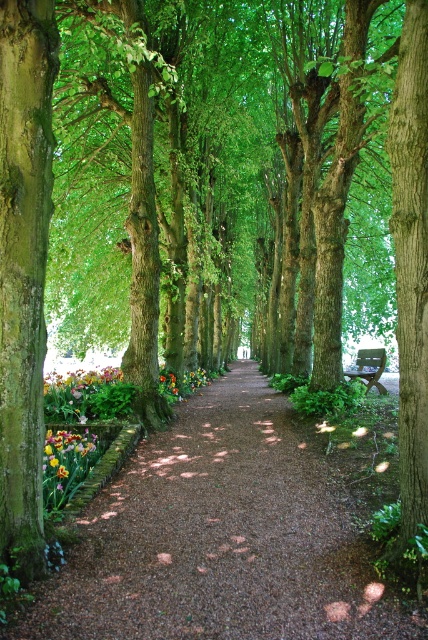
Who is lower down, brown gravel path at center or bright yellow tulip at lower left?

brown gravel path at center is lower down.

Is brown gravel path at center behind bright yellow tulip at lower left?

No, brown gravel path at center is in front of bright yellow tulip at lower left.

Identify the location of brown gravel path at center. The width and height of the screenshot is (428, 640). (222, 538).

Is point (48, 465) less distant than point (62, 381)?

Yes, point (48, 465) is in front of point (62, 381).

Is the position of bright yellow tulip at lower left more distant than that of vibrant multicolored petals at center?

No.

Is point (64, 458) farther from camera compared to point (110, 378)?

No.

You are a GUI agent. You are given a task and a screenshot of the screen. Output one action in this format:
    pyautogui.click(x=<x>, y=<y>)
    Task: Click on the bright yellow tulip at lower left
    Image resolution: width=428 pixels, height=640 pixels.
    Given the screenshot: What is the action you would take?
    (x=68, y=458)

Can you confirm if brown gravel path at center is bigger than multicolored fabric flowers at center?

Indeed, brown gravel path at center has a larger size compared to multicolored fabric flowers at center.

How distant is brown gravel path at center from multicolored fabric flowers at center?

A distance of 9.63 feet exists between brown gravel path at center and multicolored fabric flowers at center.

Who is more distant from viewer, (267, 449) or (172, 388)?

The point (172, 388) is behind.

At what (x,y) coordinates should I click in order to perform the action: click on brown gravel path at center. Please return your answer as a coordinate pair (x, y). This screenshot has width=428, height=640. Looking at the image, I should click on (222, 538).